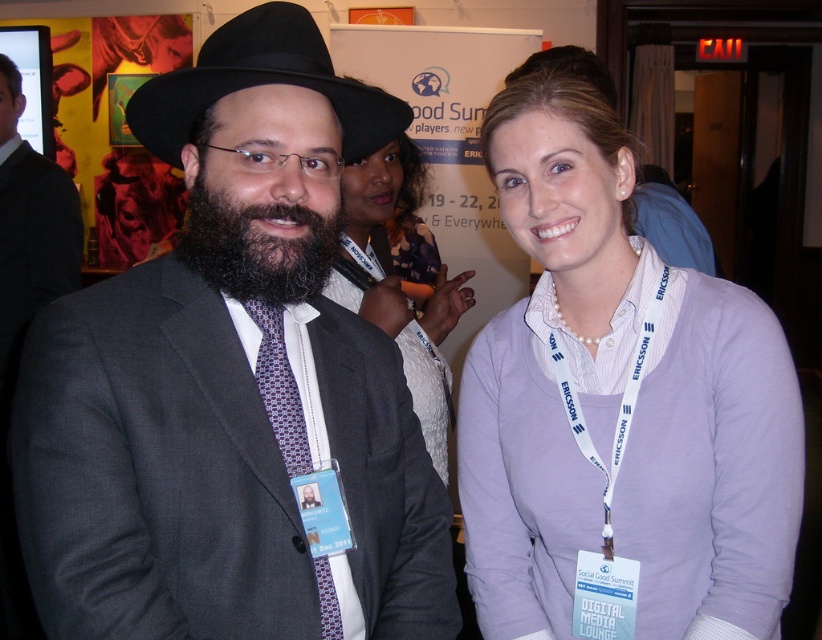
You are at the Social Good Summit and want to take a photo of both the white matte shirt at center and the matte white shirt at center. Since they are positioned differently, which one should you focus on first to ensure both are in clear view?

The white matte shirt at center is closer to the viewer than the matte white shirt at center, so focus on the closer one first to ensure both are in clear view.

You are standing at point (713,506) and want to take a photo of the Social Good Summit backdrop. The camera you have can focus on objects within 1 meter. Will the backdrop be in focus?

The distance between point (713,506) and the camera is 1.01 meters, which is slightly beyond the camera focus range of 1 meter. Therefore, the backdrop will not be in focus.